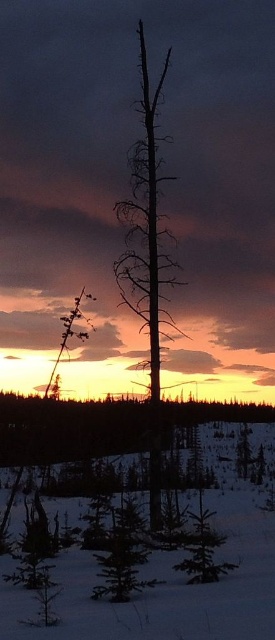
Based on the photo, which is more to the left, green matte evergreen tree at center or green matte evergreen tree at lower center?

From the viewer's perspective, green matte evergreen tree at center appears more on the left side.

Who is higher up, green matte evergreen tree at center or green matte evergreen tree at lower center?

green matte evergreen tree at lower center is above.

At what (x,y) coordinates should I click in order to perform the action: click on green matte evergreen tree at center. Please return your answer as a coordinate pair (x, y). Looking at the image, I should click on pos(122,554).

Which is behind, point (147, 157) or point (209, 531)?

Point (147, 157)

Between silhouette bare tree at center and green matte evergreen tree at lower center, which one has less height?

Standing shorter between the two is green matte evergreen tree at lower center.

This screenshot has height=640, width=275. Find the location of `silhouette bare tree at center`. silhouette bare tree at center is located at coordinates (147, 257).

How far apart are white fluffy snow at center and silhouette bare tree at center?

They are 8.85 meters apart.

Is white fluffy snow at center taller than silhouette bare tree at center?

Incorrect, white fluffy snow at center's height is not larger of silhouette bare tree at center's.

Between point (136, 611) and point (154, 138), which one is positioned in front?

Positioned in front is point (136, 611).

Find the location of a particular element. Image resolution: width=275 pixels, height=640 pixels. white fluffy snow at center is located at coordinates (169, 582).